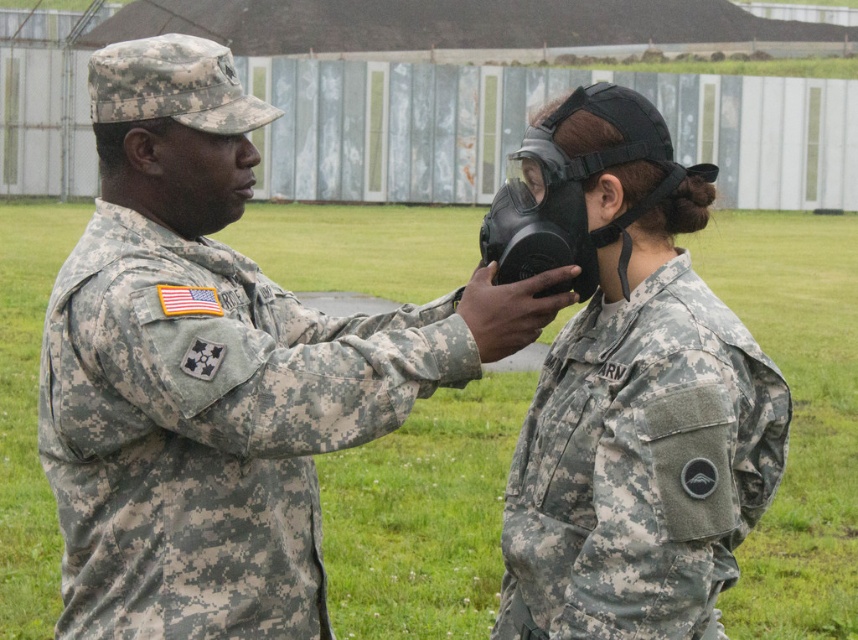
Is matte black gas mask at center below matte black mask at center?

Correct, matte black gas mask at center is located below matte black mask at center.

From the picture: Can you confirm if matte black gas mask at center is thinner than matte black mask at center?

In fact, matte black gas mask at center might be wider than matte black mask at center.

Who is more forward, (591, 291) or (575, 301)?

Point (575, 301) is in front.

At what (x,y) coordinates should I click in order to perform the action: click on matte black gas mask at center. Please return your answer as a coordinate pair (x, y). Looking at the image, I should click on (629, 392).

Between camouflage uniform at left and matte black gas mask at center, which one appears on the left side from the viewer's perspective?

camouflage uniform at left

Is camouflage uniform at left closer to camera compared to matte black gas mask at center?

No, camouflage uniform at left is behind matte black gas mask at center.

What do you see at coordinates (202, 372) in the screenshot?
I see `camouflage uniform at left` at bounding box center [202, 372].

You are a GUI agent. You are given a task and a screenshot of the screen. Output one action in this format:
    pyautogui.click(x=<x>, y=<y>)
    Task: Click on the camouflage uniform at left
    The width and height of the screenshot is (858, 640).
    Given the screenshot: What is the action you would take?
    pyautogui.click(x=202, y=372)

Is point (95, 374) closer to viewer compared to point (492, 285)?

Yes.

Between point (125, 563) and point (560, 298), which one is positioned behind?

Point (125, 563)

Locate an element on the screen. The image size is (858, 640). camouflage uniform at left is located at coordinates (202, 372).